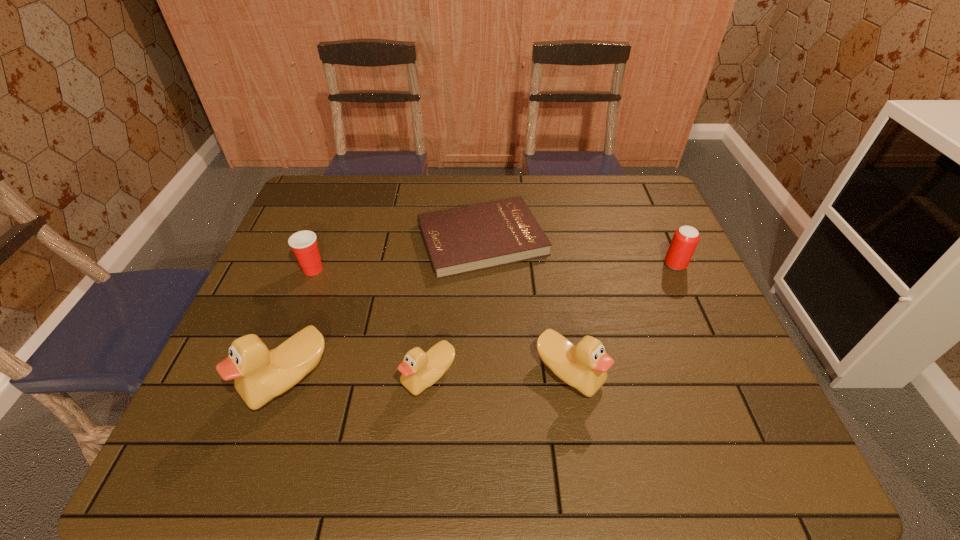
What are the coordinates of `the leftmost duck` in the screenshot? It's located at (260, 375).

Locate an element on the screen. the tallest duck is located at coordinates (260, 375).

Where is `the shortest duck`? This screenshot has height=540, width=960. the shortest duck is located at coordinates (420, 370).

Find the location of `the second shortest duck`. the second shortest duck is located at coordinates (584, 366).

The image size is (960, 540). I want to click on hardback book, so click(460, 240).

In order to click on Dixie cup in this screenshot , I will do `click(303, 243)`.

Where is `beer can`? This screenshot has width=960, height=540. beer can is located at coordinates (685, 239).

You are a GUI agent. You are given a task and a screenshot of the screen. Output one action in this format:
    pyautogui.click(x=<x>, y=<y>)
    Task: Click on the vacant area situated 0.070m at the beak of the tallest object
    The width and height of the screenshot is (960, 540).
    Given the screenshot: What is the action you would take?
    tap(216, 379)

Identify the location of vacant position located 0.060m at the beak of the tallest object. (220, 379).

Find the location of a particular element. Image resolution: width=960 pixels, height=540 pixels. vacant region located at the beak of the tallest object is located at coordinates (225, 379).